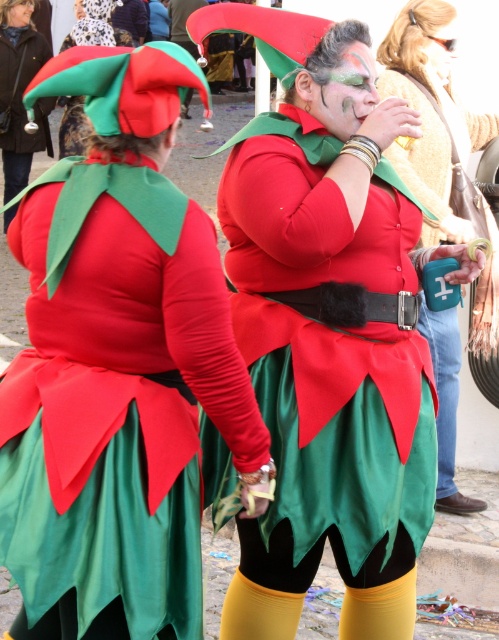
You are standing in front of the two elves in their festive costumes. You notice two points marked in the image. Which point, point 1 at coordinates [412,12] or point 2 at [29,10], is closer to you?

Point 1 at coordinates [412,12] is closer to you than point 2 at [29,10].

You are an elf costume designer looking at the image of two elves. You notice the matte red fabric at center and the matte fabric elf costume at center. Which one is covering the other?

The matte red fabric at center is positioned over the matte fabric elf costume at center, so it is covering it.

Where is the matte green fabric hat at upper center located in the image?

The matte green fabric hat at upper center is located at point (132, 19) in the image.